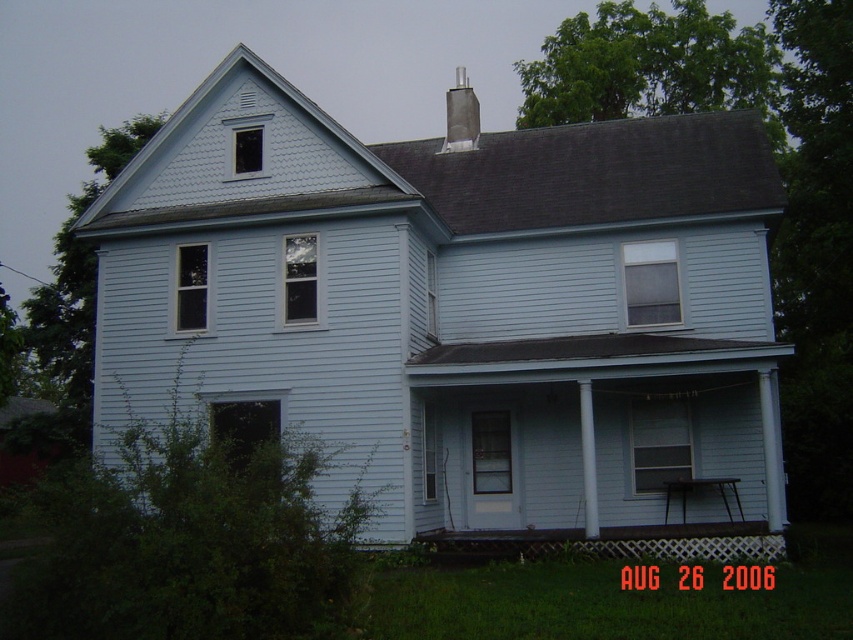
How much distance is there between white lattice porch at lower center and dark gray concrete chimney at upper center?

white lattice porch at lower center and dark gray concrete chimney at upper center are 102.42 feet apart from each other.

Is white lattice porch at lower center taller than dark gray concrete chimney at upper center?

No, white lattice porch at lower center is not taller than dark gray concrete chimney at upper center.

Locate an element on the screen. white lattice porch at lower center is located at coordinates (619, 541).

Who is higher up, white wood siding at center or dark gray concrete chimney at upper center?

Positioned higher is dark gray concrete chimney at upper center.

Can you confirm if white wood siding at center is shorter than dark gray concrete chimney at upper center?

Correct, white wood siding at center is not as tall as dark gray concrete chimney at upper center.

Find the location of a particular element. This screenshot has height=640, width=853. white wood siding at center is located at coordinates (457, 307).

Find the location of `white wood siding at center`. white wood siding at center is located at coordinates pyautogui.click(x=457, y=307).

Can you confirm if white wood siding at center is wider than white lattice porch at lower center?

Yes, white wood siding at center is wider than white lattice porch at lower center.

From the picture: Can you confirm if white wood siding at center is shorter than white lattice porch at lower center?

No, white wood siding at center is not shorter than white lattice porch at lower center.

What do you see at coordinates (457, 307) in the screenshot?
I see `white wood siding at center` at bounding box center [457, 307].

Where is `white wood siding at center`? The width and height of the screenshot is (853, 640). white wood siding at center is located at coordinates (457, 307).